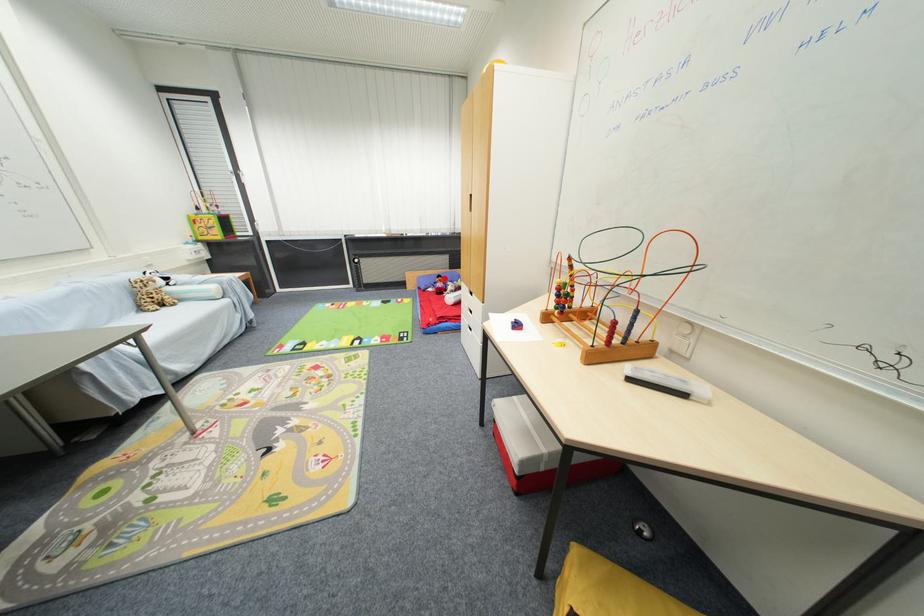
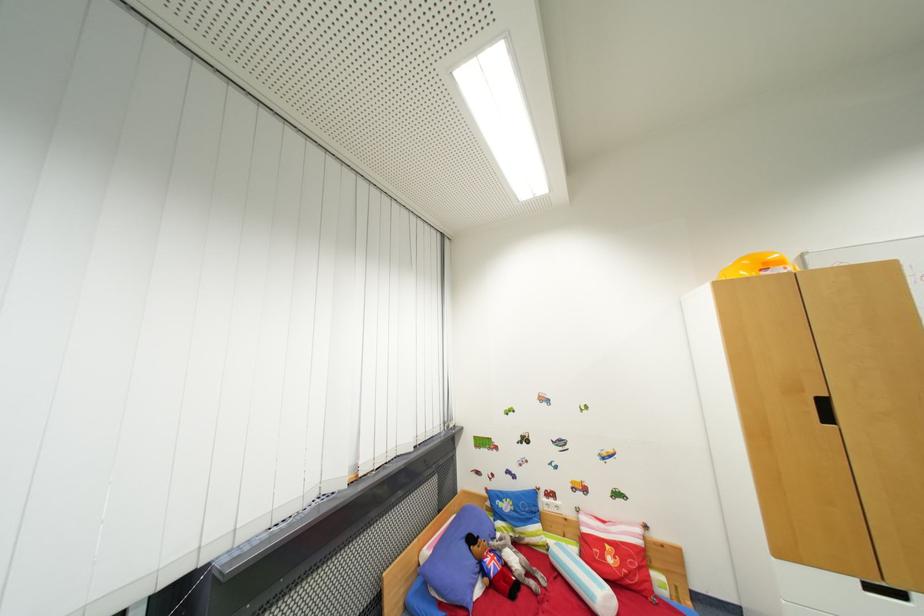
The point at the highlighted location is marked in the first image. Where is the corresponding point in the second image?

(477, 541)